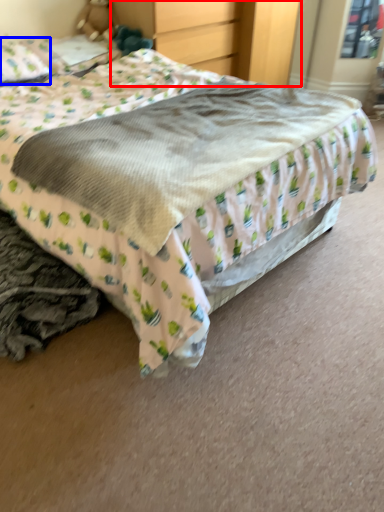
Question: Which point is further to the camera, dresser (highlighted by a red box) or pillow (highlighted by a blue box)?

Choices:
 (A) dresser
 (B) pillow

Answer: (A)